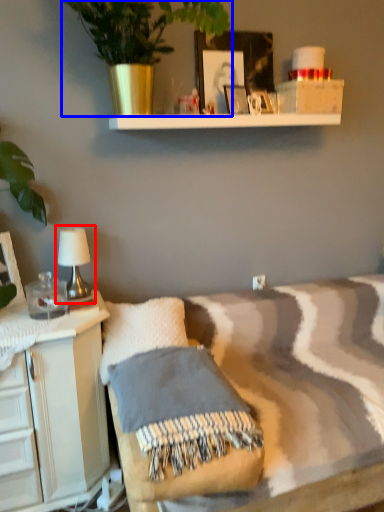
Question: Which object appears closest to the camera in this image, table lamp (highlighted by a red box) or houseplant (highlighted by a blue box)?

Choices:
 (A) table lamp
 (B) houseplant

Answer: (B)